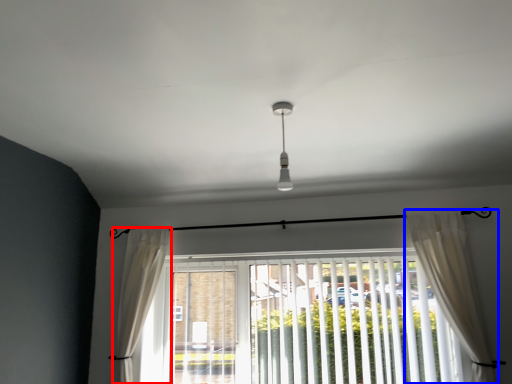
Question: Which object appears farthest to the camera in this image, curtain (highlighted by a red box) or curtain (highlighted by a blue box)?

Choices:
 (A) curtain
 (B) curtain

Answer: (A)